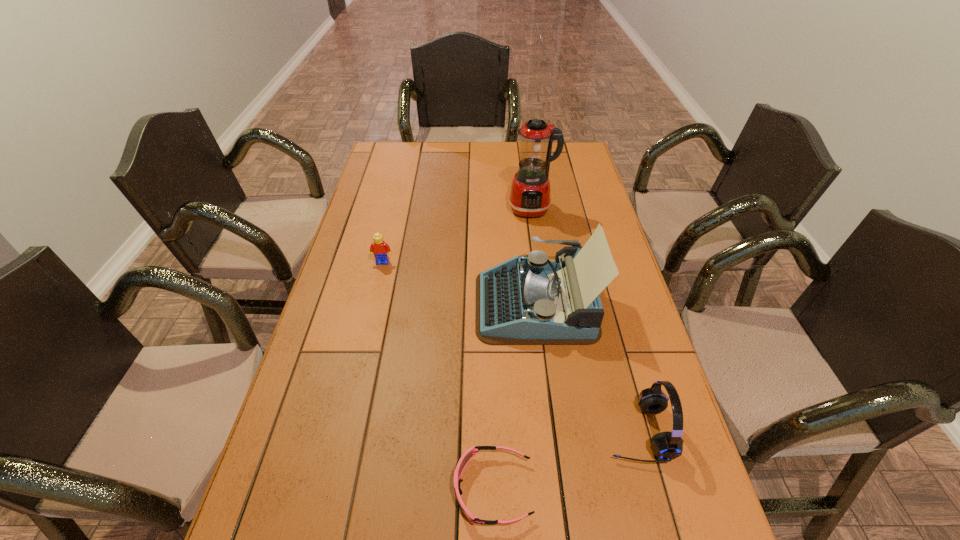
Where is `typewriter positioned at the right edge`? typewriter positioned at the right edge is located at coordinates (527, 300).

I want to click on headset that is at the right edge, so click(667, 446).

You are a GUI agent. You are given a task and a screenshot of the screen. Output one action in this format:
    pyautogui.click(x=<x>, y=<y>)
    Task: Click on the free space at the far edge of the desktop
    The image size is (960, 540).
    Given the screenshot: What is the action you would take?
    pyautogui.click(x=516, y=167)

In the image, there is a desktop. In order to click on vacant space at the left edge in this screenshot , I will do click(370, 179).

The width and height of the screenshot is (960, 540). What are the coordinates of `vacant space at the right edge of the desktop` in the screenshot? It's located at (614, 238).

Identify the location of vacant point located between the shortest object and the headset. The image size is (960, 540). [x=565, y=460].

This screenshot has width=960, height=540. Find the location of `vacant area that lies between the typewriter and the Lego`. vacant area that lies between the typewriter and the Lego is located at coordinates (459, 283).

I want to click on free space between the tallest object and the goggles, so click(513, 349).

In order to click on blank region between the typewriter and the fourth tallest object in this screenshot , I will do `click(459, 283)`.

What are the coordinates of `free space that is in between the second tallest object and the third tallest object` in the screenshot? It's located at (587, 368).